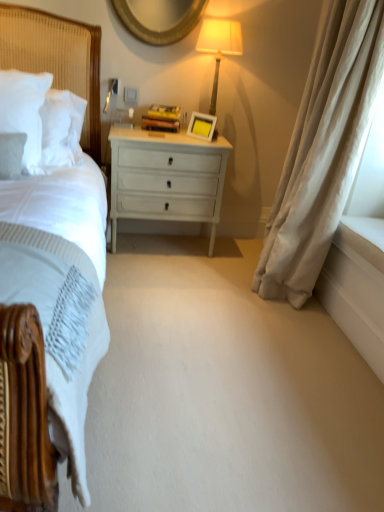
Question: From a real-world perspective, is white soft pillow at left over white glossy drawer at center?

Choices:
 (A) yes
 (B) no

Answer: (A)

Question: Can you confirm if white soft pillow at left is shorter than white glossy drawer at center?

Choices:
 (A) yes
 (B) no

Answer: (A)

Question: Is white soft pillow at left to the left of white glossy drawer at center from the viewer's perspective?

Choices:
 (A) yes
 (B) no

Answer: (A)

Question: Can you confirm if white soft pillow at left is thinner than white glossy drawer at center?

Choices:
 (A) yes
 (B) no

Answer: (A)

Question: From a real-world perspective, is white soft pillow at left under white glossy drawer at center?

Choices:
 (A) no
 (B) yes

Answer: (A)

Question: Is white soft pillow at left smaller than white glossy drawer at center?

Choices:
 (A) yes
 (B) no

Answer: (A)

Question: Is beige velvet curtain at right aimed at white textured headboard at left?

Choices:
 (A) no
 (B) yes

Answer: (B)

Question: From the image's perspective, is beige velvet curtain at right located beneath white textured headboard at left?

Choices:
 (A) no
 (B) yes

Answer: (B)

Question: From the image's perspective, is beige velvet curtain at right on white textured headboard at left?

Choices:
 (A) yes
 (B) no

Answer: (B)

Question: Does beige velvet curtain at right come in front of white textured headboard at left?

Choices:
 (A) no
 (B) yes

Answer: (B)

Question: From a real-world perspective, is beige velvet curtain at right over white textured headboard at left?

Choices:
 (A) no
 (B) yes

Answer: (A)

Question: Can you confirm if beige velvet curtain at right is bigger than white textured headboard at left?

Choices:
 (A) no
 (B) yes

Answer: (B)

Question: Considering the relative positions of white glossy drawer at center and white soft pillow at left in the image provided, is white glossy drawer at center to the left of white soft pillow at left from the viewer's perspective?

Choices:
 (A) yes
 (B) no

Answer: (B)